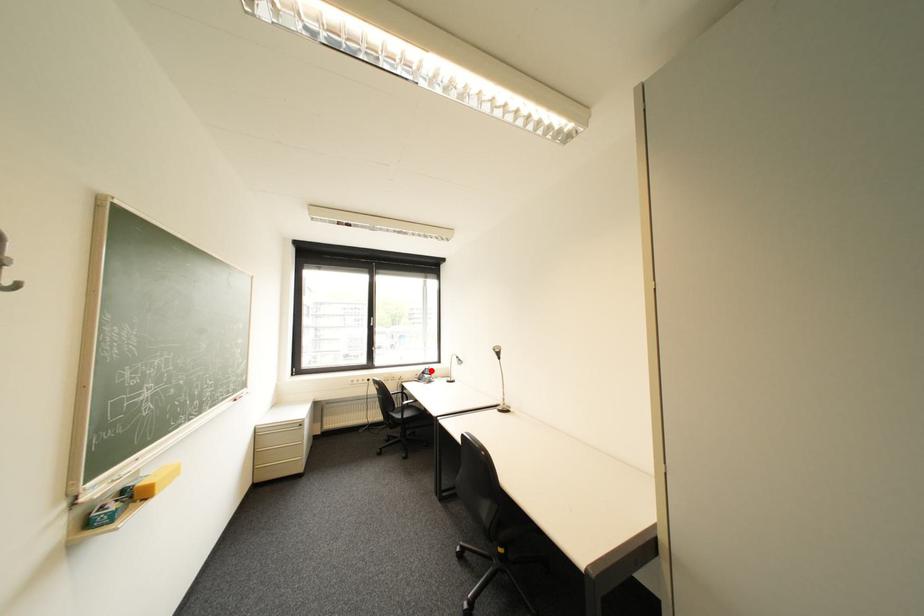
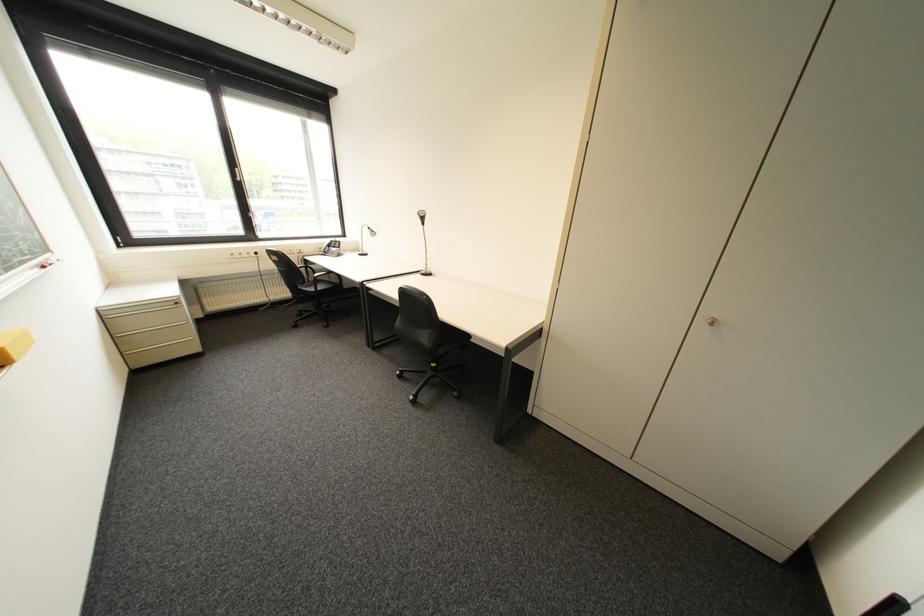
The point at the highlighted location is marked in the first image. Where is the corresponding point in the second image?

(335, 244)